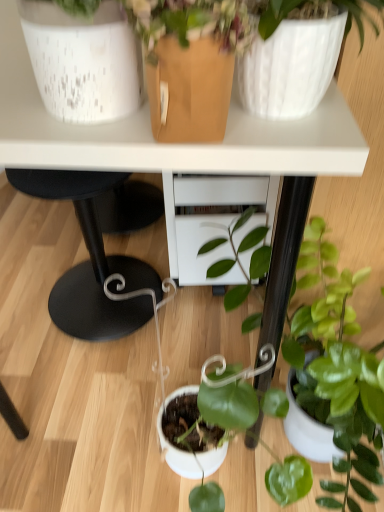
At what (x,y) coordinates should I click in order to perform the action: click on white speckled ceramic pot at upper left. Please return your answer as a coordinate pair (x, y). This screenshot has width=384, height=512. Looking at the image, I should click on (83, 61).

Find the location of `green glossy plant at lower right`. green glossy plant at lower right is located at coordinates (331, 351).

Identify the location of white speckled ceramic pot at upper left. The height and width of the screenshot is (512, 384). (83, 61).

Which is in front, point (71, 66) or point (58, 154)?

The point (71, 66) is in front.

From the image's perspective, is white speckled ceramic pot at upper left on top of white glossy table at upper center?

No, from the image's perspective, white speckled ceramic pot at upper left is not on top of white glossy table at upper center.

Is white speckled ceramic pot at upper left bigger than white glossy table at upper center?

Incorrect, white speckled ceramic pot at upper left is not larger than white glossy table at upper center.

Would you consider white speckled ceramic pot at upper left to be distant from white glossy table at upper center?

No, white speckled ceramic pot at upper left is in close proximity to white glossy table at upper center.

Which is behind, white speckled ceramic pot at upper left or green glossy plant at lower right?

green glossy plant at lower right.

Is white speckled ceramic pot at upper left at the left side of green glossy plant at lower right?

Yes.

Which of these two, white speckled ceramic pot at upper left or green glossy plant at lower right, stands taller?

With more height is green glossy plant at lower right.

Is white speckled ceramic pot at upper left positioned with its back to green glossy plant at lower right?

No, white speckled ceramic pot at upper left's orientation is not away from green glossy plant at lower right.

Between white glossy table at upper center and white speckled ceramic pot at upper left, which one appears on the right side from the viewer's perspective?

white glossy table at upper center.

Considering their positions, is white glossy table at upper center located in front of or behind white speckled ceramic pot at upper left?

Visually, white glossy table at upper center is located behind white speckled ceramic pot at upper left.

From the image's perspective, would you say white glossy table at upper center is shown under white speckled ceramic pot at upper left?

Incorrect, from the image's perspective, white glossy table at upper center is higher than white speckled ceramic pot at upper left.

Looking at this image, is white glossy table at upper center inside the boundaries of white speckled ceramic pot at upper left, or outside?

white glossy table at upper center exists outside the volume of white speckled ceramic pot at upper left.

Measure the distance from white glossy table at upper center to green glossy plant at lower right.

white glossy table at upper center and green glossy plant at lower right are 41.73 centimeters apart from each other.

From the image's perspective, is white glossy table at upper center over green glossy plant at lower right?

Correct, white glossy table at upper center appears higher than green glossy plant at lower right in the image.

Considering the positions of objects white glossy table at upper center and green glossy plant at lower right in the image provided, who is more to the right, white glossy table at upper center or green glossy plant at lower right?

Positioned to the right is green glossy plant at lower right.

Considering the relative sizes of white glossy table at upper center and green glossy plant at lower right in the image provided, is white glossy table at upper center bigger than green glossy plant at lower right?

Yes, white glossy table at upper center is bigger than green glossy plant at lower right.

From the image's perspective, which is above, green glossy plant at lower right or white glossy table at upper center?

white glossy table at upper center is shown above in the image.

Is green glossy plant at lower right in front of or behind white glossy table at upper center in the image?

green glossy plant at lower right is positioned closer to the viewer than white glossy table at upper center.

Consider the image. Does green glossy plant at lower right turn towards white glossy table at upper center?

No, green glossy plant at lower right does not turn towards white glossy table at upper center.

Can you tell me how much green glossy plant at lower right and white speckled ceramic pot at upper left differ in facing direction?

0.000505 degrees separate the facing orientations of green glossy plant at lower right and white speckled ceramic pot at upper left.

Is green glossy plant at lower right aimed at white speckled ceramic pot at upper left?

No, green glossy plant at lower right is not oriented towards white speckled ceramic pot at upper left.

Based on their sizes in the image, would you say green glossy plant at lower right is bigger or smaller than white speckled ceramic pot at upper left?

Considering their sizes, green glossy plant at lower right takes up more space than white speckled ceramic pot at upper left.

Does green glossy plant at lower right touch white speckled ceramic pot at upper left?

green glossy plant at lower right is not next to white speckled ceramic pot at upper left, and they're not touching.

This screenshot has width=384, height=512. I want to click on table above the white speckled ceramic pot at upper left (from the image's perspective), so click(164, 144).

At what (x,y) coordinates should I click in order to perform the action: click on houseplant on the right of the white speckled ceramic pot at upper left. Please return your answer as a coordinate pair (x, y). The image size is (384, 512). Looking at the image, I should click on (331, 351).

When comparing their distances from green glossy plant at lower right, does white glossy table at upper center or white speckled ceramic pot at upper left seem closer?

Based on the image, white glossy table at upper center appears to be nearer to green glossy plant at lower right.

Based on their spatial positions, is white speckled ceramic pot at upper left or green glossy plant at lower right closer to white glossy table at upper center?

white speckled ceramic pot at upper left.

Looking at the image, which one is located closer to white speckled ceramic pot at upper left, green glossy plant at lower right or white glossy table at upper center?

white glossy table at upper center is positioned closer to the anchor white speckled ceramic pot at upper left.

Consider the image. Estimate the real-world distances between objects in this image. Which object is further from green glossy plant at lower right, white speckled ceramic pot at upper left or white glossy table at upper center?

The object further to green glossy plant at lower right is white speckled ceramic pot at upper left.

From the image, which object appears to be farther from white glossy table at upper center, green glossy plant at lower right or white speckled ceramic pot at upper left?

Among the two, green glossy plant at lower right is located further to white glossy table at upper center.

Based on their spatial positions, is white glossy table at upper center or green glossy plant at lower right further from white speckled ceramic pot at upper left?

Among the two, green glossy plant at lower right is located further to white speckled ceramic pot at upper left.

Where is `flowerpot between white glossy table at upper center and green glossy plant at lower right vertically`? This screenshot has width=384, height=512. flowerpot between white glossy table at upper center and green glossy plant at lower right vertically is located at coordinates (83, 61).